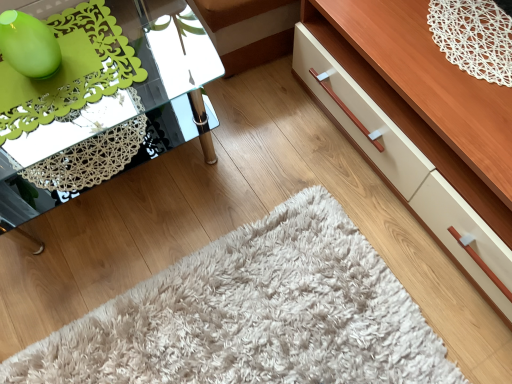
Question: Based on their sizes in the image, would you say clear glass table at left is bigger or smaller than wooden dresser at lower right?

Choices:
 (A) small
 (B) big

Answer: (A)

Question: From a real-world perspective, relative to wooden dresser at lower right, is clear glass table at left vertically above or below?

Choices:
 (A) above
 (B) below

Answer: (A)

Question: Does point (54, 117) appear closer or farther from the camera than point (446, 168)?

Choices:
 (A) farther
 (B) closer

Answer: (B)

Question: Is wooden dresser at lower right in front of or behind clear glass table at left in the image?

Choices:
 (A) behind
 (B) front

Answer: (B)

Question: Is point (437, 223) positioned closer to the camera than point (69, 129)?

Choices:
 (A) closer
 (B) farther

Answer: (A)

Question: Is wooden dresser at lower right taller or shorter than clear glass table at left?

Choices:
 (A) tall
 (B) short

Answer: (B)

Question: From a real-world perspective, is wooden dresser at lower right positioned above or below clear glass table at left?

Choices:
 (A) below
 (B) above

Answer: (A)